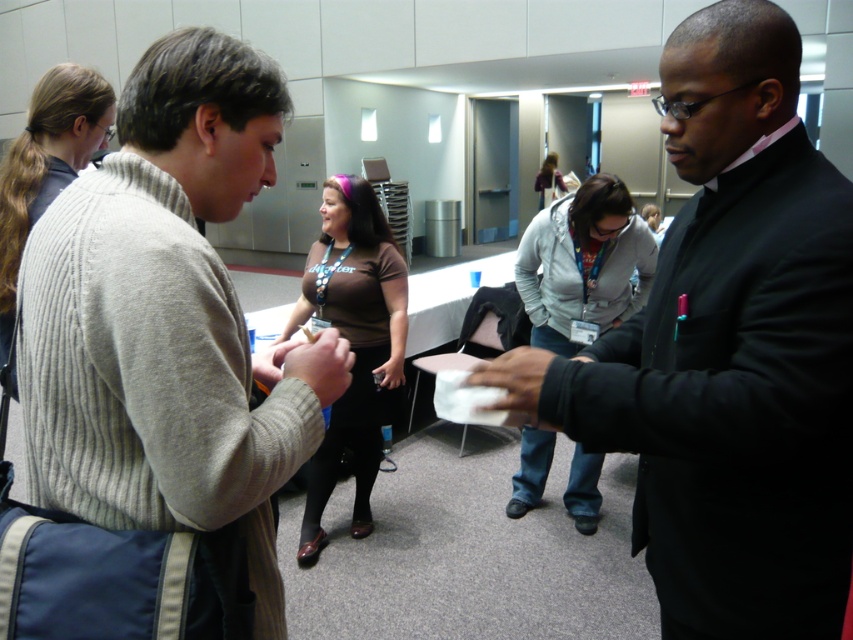
Question: Considering the real-world distances, which object is farthest from the matte brown shirt at center?

Choices:
 (A) gray fleece jacket at center
 (B) brown matte shirt at center
 (C) matte skin hand at center
 (D) black matte suit at center

Answer: (C)

Question: Does ribbed gray sweater at center have a smaller size compared to matte brown shirt at center?

Choices:
 (A) no
 (B) yes

Answer: (A)

Question: Which object is closer to the camera taking this photo?

Choices:
 (A) gray fleece jacket at center
 (B) ribbed gray sweater at center
 (C) black matte suit at center
 (D) knitted gray sweater at left

Answer: (B)

Question: Where is brown matte shirt at center located in relation to matte brown shirt at center in the image?

Choices:
 (A) below
 (B) above

Answer: (A)

Question: Considering the real-world distances, which object is farthest from the matte brown shirt at center?

Choices:
 (A) gray fleece jacket at center
 (B) brown matte shirt at center
 (C) black matte suit at center
 (D) matte skin hand at center

Answer: (D)

Question: Does brown matte shirt at center have a lesser width compared to knitted gray sweater at left?

Choices:
 (A) yes
 (B) no

Answer: (B)